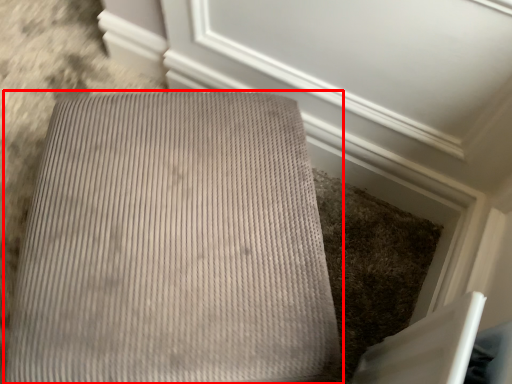
Question: From the image's perspective, where is furniture (annotated by the red box) located relative to screen door?

Choices:
 (A) above
 (B) below

Answer: (B)